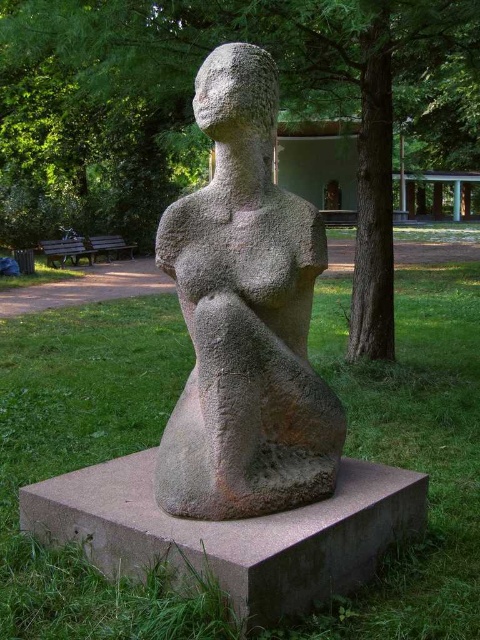
You are standing at point (86, 460) in the park. What is the immediate surface beneath your feet?

The immediate surface beneath your feet at point (86, 460) is green grass at center.

You are planning to place a new decorative item between the granite statue at center and the wooden park bench at center. Considering their widths, which object should the item be placed closer to to ensure it fits better?

The granite statue at center has a lesser width compared to the wooden park bench at center. Therefore, the decorative item should be placed closer to the granite statue at center to ensure it fits better.

You are a landscape architect designing a garden path. You need to place a bench between the green grass at center and the green textured tree at center. Which object should the bench be closer to if the bench requires more space on one side?

The bench should be closer to the green grass at center because it has a lesser width compared to the green textured tree at center, allowing more space on the side of the tree.